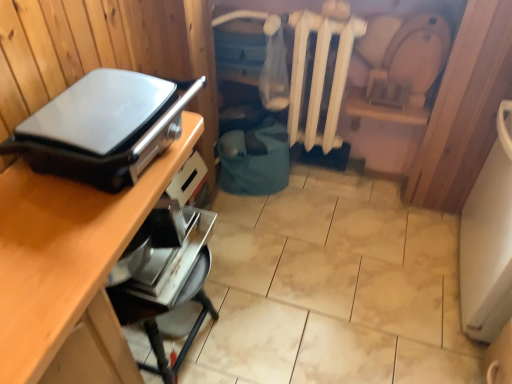
Question: Is wooden desk at upper left with white matte radiator at center?

Choices:
 (A) yes
 (B) no

Answer: (B)

Question: Is wooden desk at upper left to the right of white matte radiator at center from the viewer's perspective?

Choices:
 (A) yes
 (B) no

Answer: (B)

Question: From a real-world perspective, is wooden desk at upper left under white matte radiator at center?

Choices:
 (A) no
 (B) yes

Answer: (B)

Question: Considering the relative positions of wooden desk at upper left and white matte radiator at center in the image provided, is wooden desk at upper left to the left of white matte radiator at center from the viewer's perspective?

Choices:
 (A) no
 (B) yes

Answer: (B)

Question: Does wooden desk at upper left have a greater height compared to white matte radiator at center?

Choices:
 (A) yes
 (B) no

Answer: (A)

Question: Is wooden desk at upper left wider than white matte radiator at center?

Choices:
 (A) no
 (B) yes

Answer: (B)

Question: Is white matte radiator at center closer to camera compared to wooden desk at upper left?

Choices:
 (A) no
 (B) yes

Answer: (A)

Question: Considering the relative sizes of white matte radiator at center and wooden desk at upper left in the image provided, is white matte radiator at center thinner than wooden desk at upper left?

Choices:
 (A) yes
 (B) no

Answer: (A)

Question: Is white matte radiator at center positioned with its back to wooden desk at upper left?

Choices:
 (A) no
 (B) yes

Answer: (A)

Question: Is white matte radiator at center not close to wooden desk at upper left?

Choices:
 (A) yes
 (B) no

Answer: (A)

Question: Considering the relative sizes of white matte radiator at center and wooden desk at upper left in the image provided, is white matte radiator at center smaller than wooden desk at upper left?

Choices:
 (A) yes
 (B) no

Answer: (A)

Question: Is wooden desk at upper left completely or partially inside white matte radiator at center?

Choices:
 (A) no
 (B) yes

Answer: (A)

Question: Does metallic silver toaster at lower center, the 2th appliance positioned from the top, have a larger size compared to matte black appliance at left, arranged as the first appliance when viewed from the top?

Choices:
 (A) yes
 (B) no

Answer: (B)